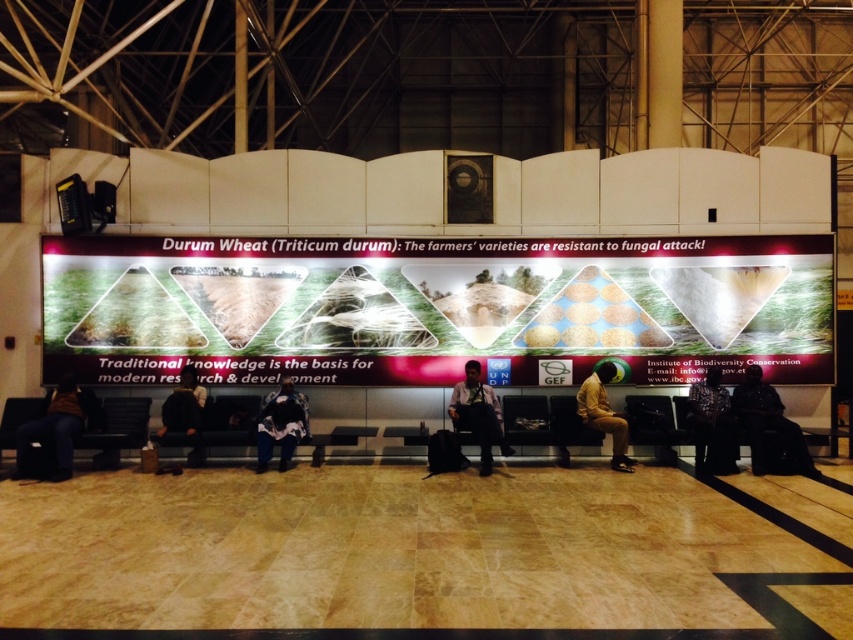
You are an event planner setting up a booth at the station. You have a matte pink poster at center and a brown leather jacket at lower left. Which object should you place first if you need to prioritize the larger item?

The matte pink poster at center should be placed first since it has a larger width than the brown leather jacket at lower left.

You are designing a layout for a new waiting area and need to place a dark brown leather jacket at center on top of the black leather bench at lower left. Will the jacket fit entirely on the bench without overhanging the edges?

The black leather bench at lower left is wider than the dark brown leather jacket at center, so the jacket will fit entirely on the bench without overhanging the edges.